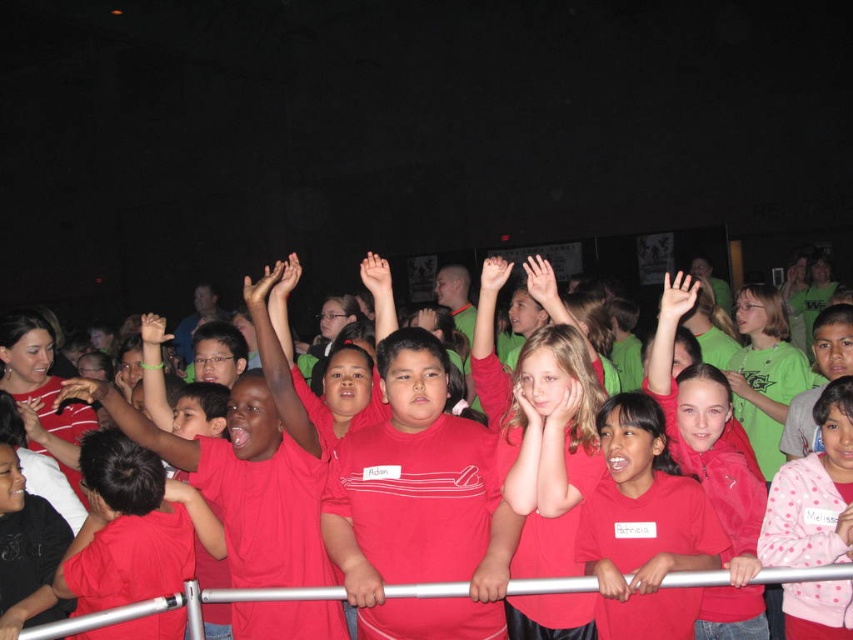
Question: Does matte red shirt at center appear on the left side of silver metallic rail at center?

Choices:
 (A) no
 (B) yes

Answer: (A)

Question: Is matte red shirts at center further to camera compared to silver metallic rail at center?

Choices:
 (A) no
 (B) yes

Answer: (B)

Question: Can you confirm if matte red shirts at center is positioned above silver metallic rail at center?

Choices:
 (A) no
 (B) yes

Answer: (B)

Question: Which of the following is the farthest from the observer?

Choices:
 (A) (207, 348)
 (B) (612, 488)
 (C) (701, 572)

Answer: (A)

Question: Which of the following is the farthest from the observer?

Choices:
 (A) matte red shirt at center
 (B) silver metallic rail at center
 (C) matte red shirts at center

Answer: (C)

Question: Among these points, which one is nearest to the camera?

Choices:
 (A) (422, 321)
 (B) (444, 593)
 (C) (653, 476)

Answer: (B)